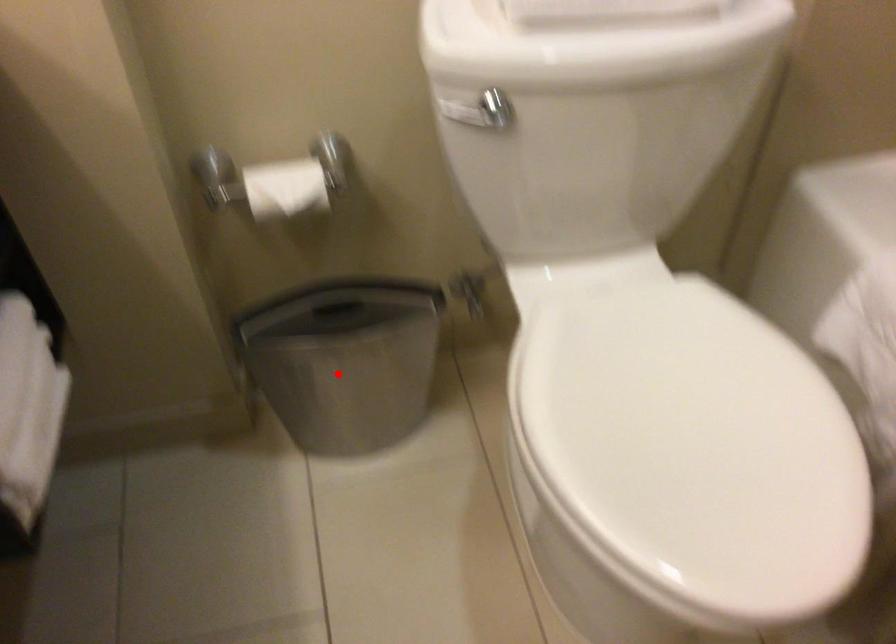
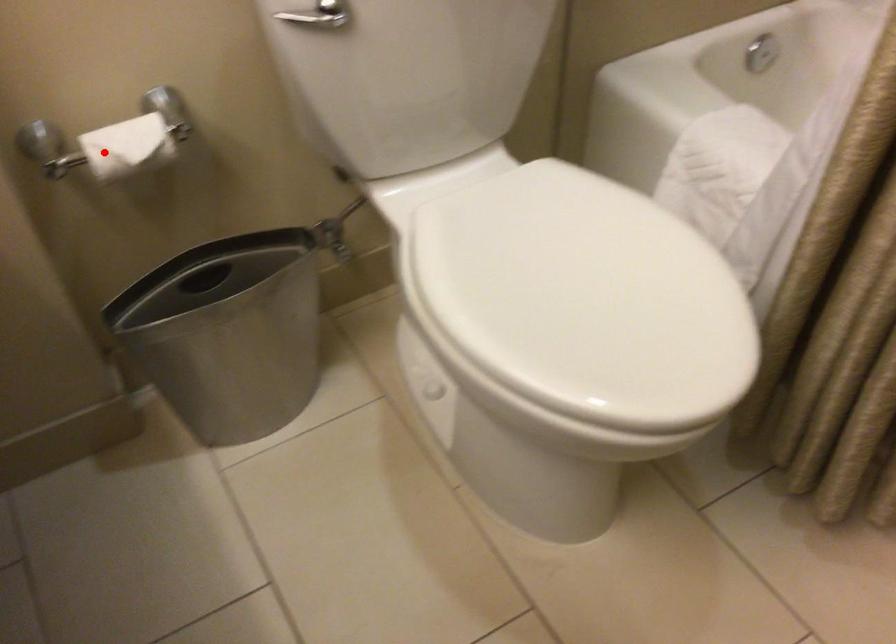
I am providing you with two images of the same scene from different viewpoints. A red point is marked on the first image and another point is marked on the second image. Does the point marked in image1 correspond to the same location as the one in image2?

No